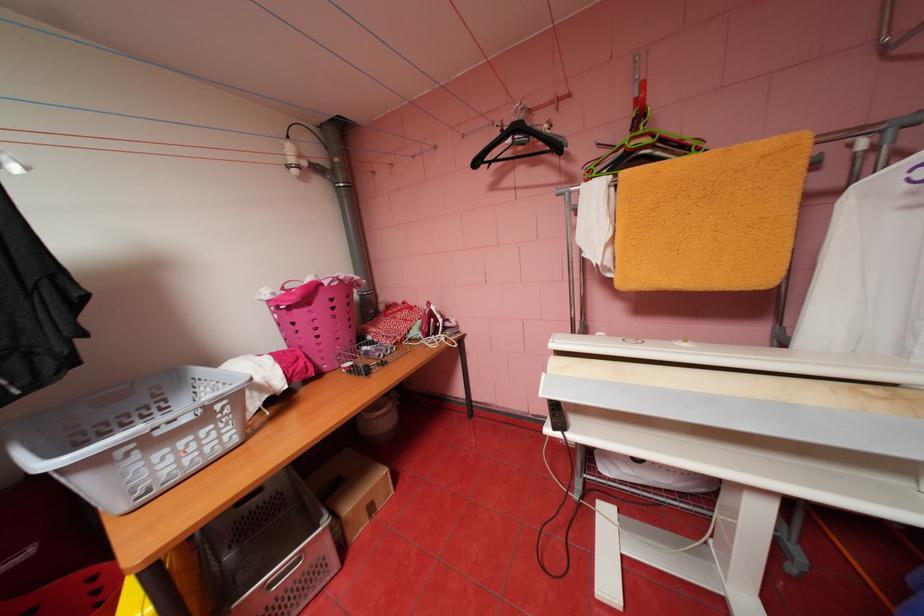
Where is `grey laundry basket`? This screenshot has height=616, width=924. grey laundry basket is located at coordinates (134, 434).